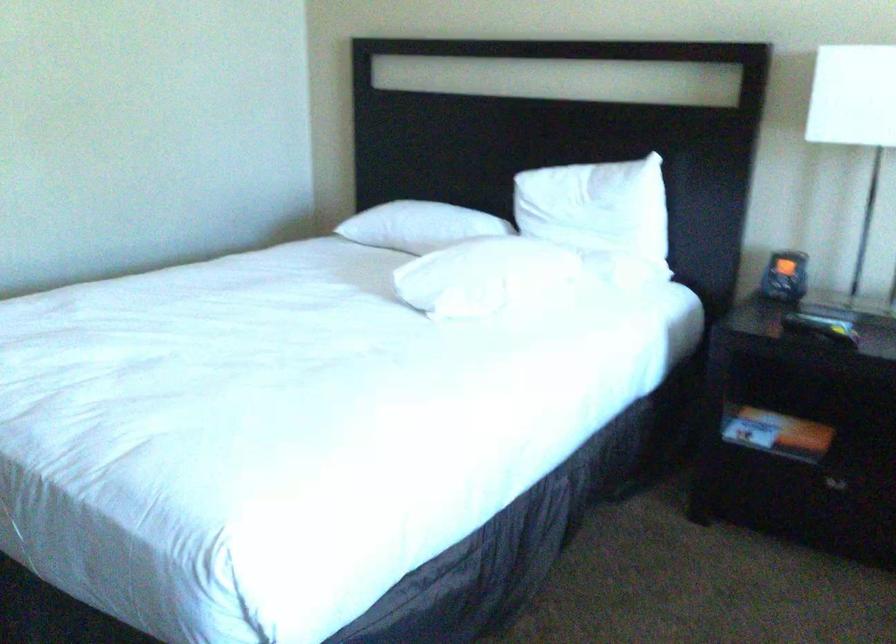
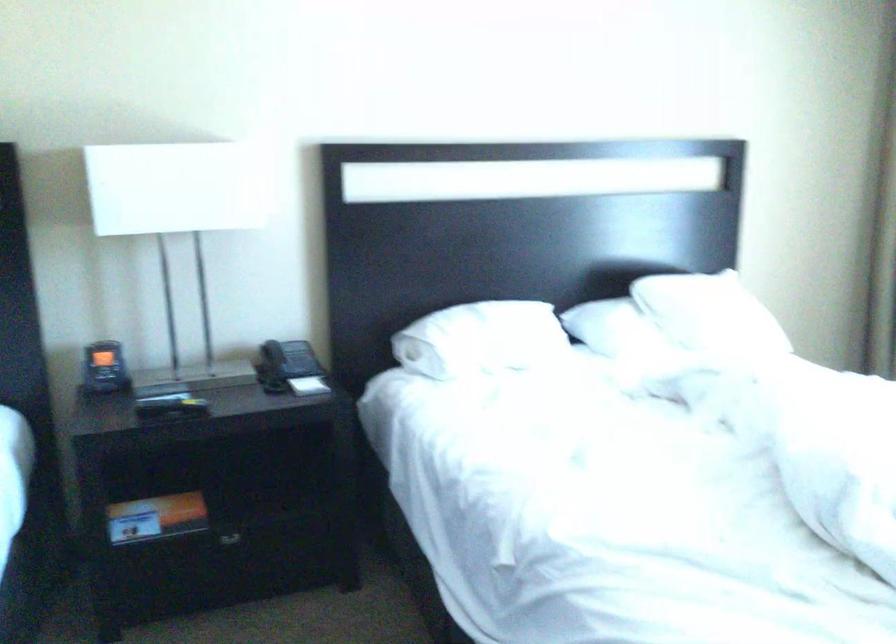
Find the pixel in the second image that matches the point at 777,268 in the first image.

(104, 368)